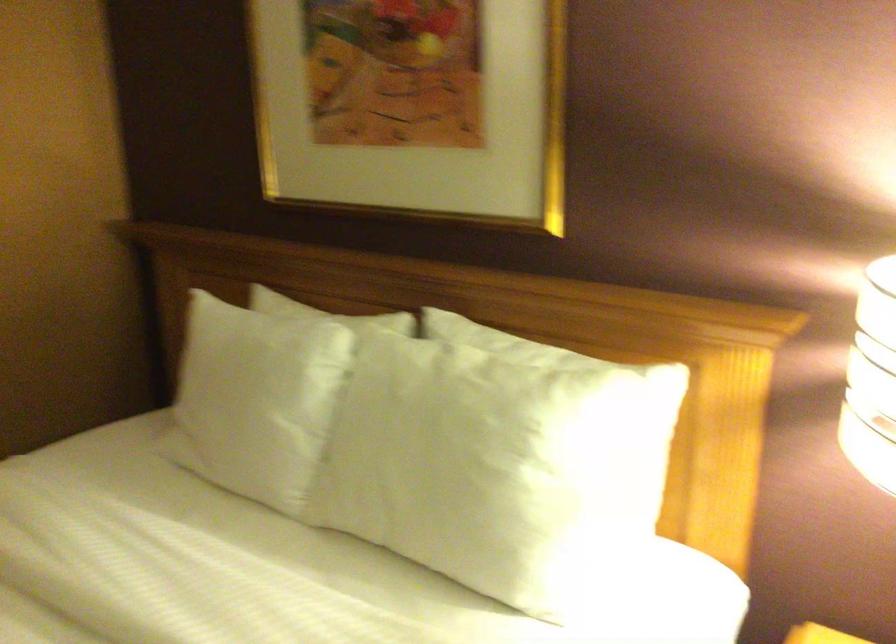
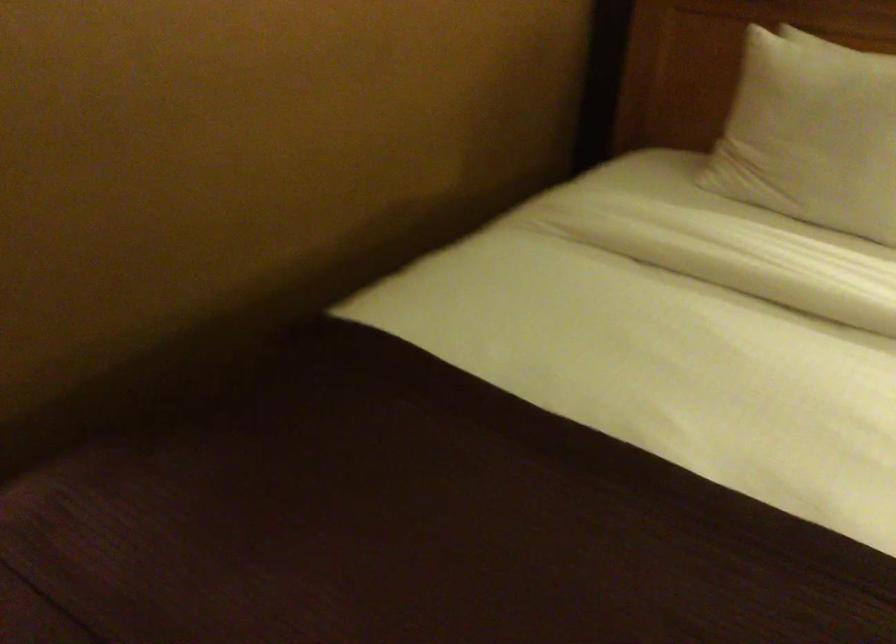
Question: The first image is from the beginning of the video and the second image is from the end. How did the camera likely rotate when shooting the video?

Choices:
 (A) Left
 (B) Right
 (C) Up
 (D) Down

Answer: (D)